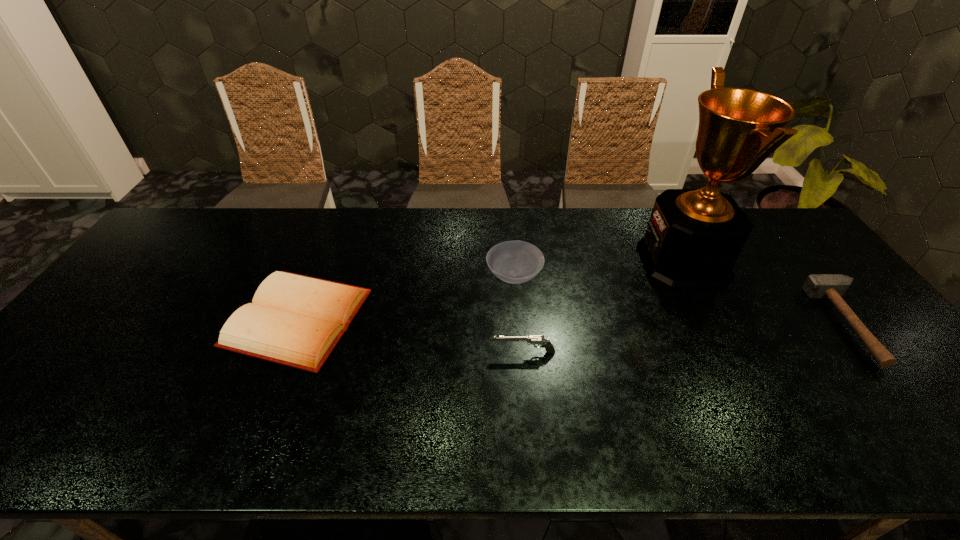
The width and height of the screenshot is (960, 540). I want to click on the tallest object, so click(x=694, y=236).

Locate an element on the screen. the fourth object from left to right is located at coordinates (694, 236).

This screenshot has width=960, height=540. I want to click on bowl, so click(x=514, y=262).

The height and width of the screenshot is (540, 960). What are the coordinates of `pistol` in the screenshot? It's located at (531, 340).

The height and width of the screenshot is (540, 960). In order to click on hammer in this screenshot , I will do `click(832, 286)`.

The height and width of the screenshot is (540, 960). Find the location of `the leftmost object`. the leftmost object is located at coordinates (295, 320).

Find the location of a particular element. The image size is (960, 540). free space located 0.360m on the front of the trophy cup with the label is located at coordinates (526, 262).

In order to click on vacant space located 0.210m on the front of the trophy cup with the label in this screenshot , I will do `click(574, 262)`.

Locate an element on the screen. This screenshot has height=540, width=960. free space located on the front of the trophy cup with the label is located at coordinates (581, 262).

The width and height of the screenshot is (960, 540). Identify the location of free region located on the left of the bowl. (422, 276).